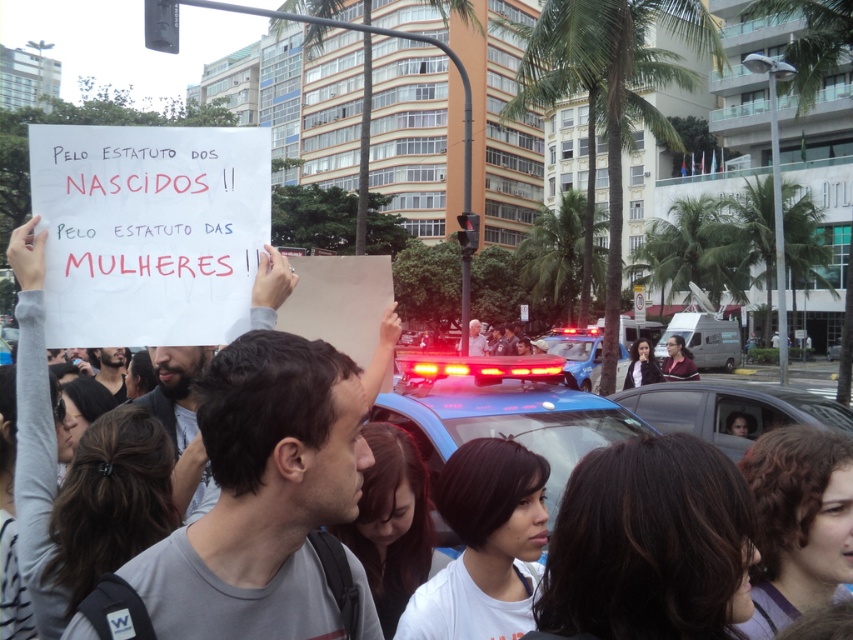
Question: Can you confirm if gray cotton shirt at center is positioned to the left of black matte shirt at center?

Choices:
 (A) yes
 (B) no

Answer: (B)

Question: Can you confirm if gray cotton shirt at center is positioned to the left of black matte shirt at center?

Choices:
 (A) no
 (B) yes

Answer: (A)

Question: Which of the following is the farthest from the observer?

Choices:
 (A) 126,364
 (B) 320,609

Answer: (A)

Question: From the image, what is the correct spatial relationship of gray cotton shirt at center in relation to black matte shirt at center?

Choices:
 (A) left
 (B) right

Answer: (B)